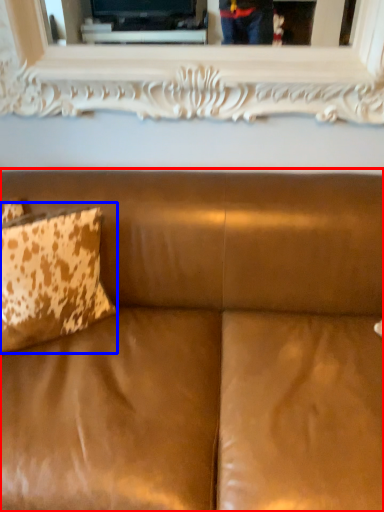
Question: Among these objects, which one is nearest to the camera, studio couch (highlighted by a red box) or pillow (highlighted by a blue box)?

Choices:
 (A) studio couch
 (B) pillow

Answer: (A)